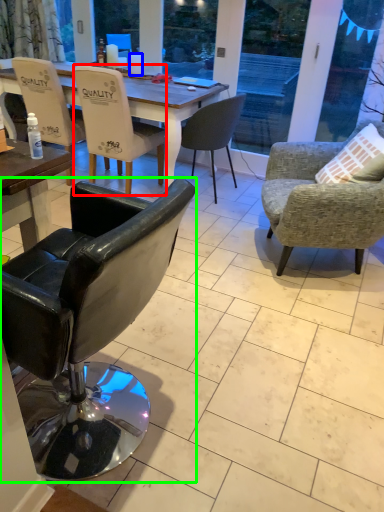
Question: Based on their relative distances, which object is nearer to chair (highlighted by a red box)? Choose from coffee cup (highlighted by a blue box) and chair (highlighted by a green box).

Choices:
 (A) coffee cup
 (B) chair

Answer: (A)